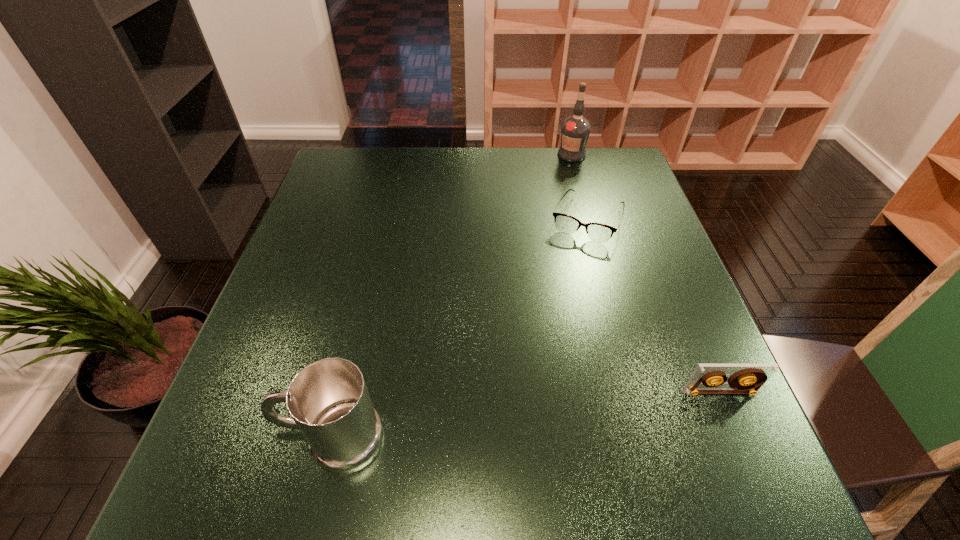
Locate an element on the screen. The width and height of the screenshot is (960, 540). vacant space on the desktop that is between the mug and the second shortest object and is positioned on the face of the third nearest object is located at coordinates (498, 419).

Find the location of `vacant spot on the desktop that is between the nearest object and the videotape and is positioned on the front label of the vodka`. vacant spot on the desktop that is between the nearest object and the videotape and is positioned on the front label of the vodka is located at coordinates (584, 409).